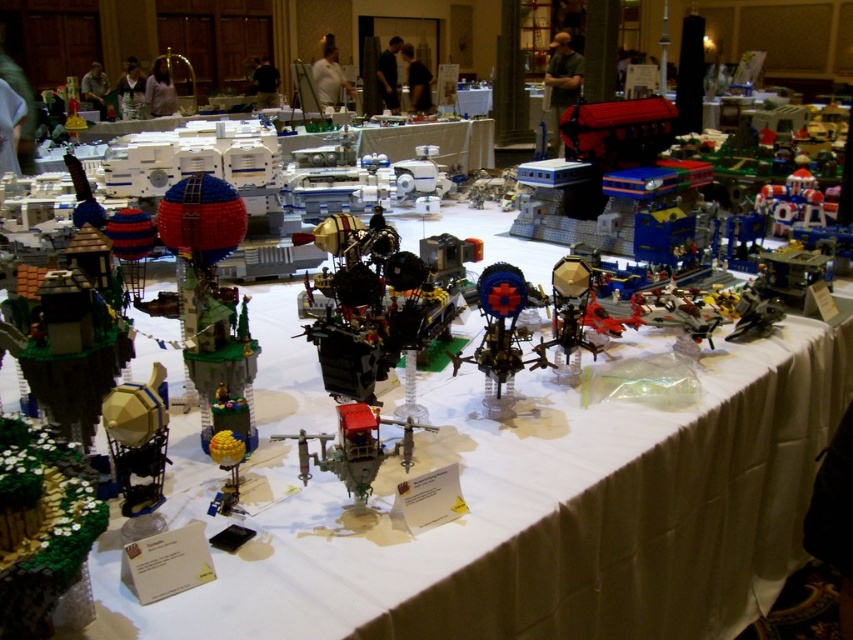
Question: Which object appears closest to the camera in this image?

Choices:
 (A) metallic blue sphere at center
 (B) metallic gold sphere at center
 (C) matte red helicopter at center

Answer: (A)

Question: Where is green grassy tree at lower left located in relation to metallic blue sphere at center in the image?

Choices:
 (A) above
 (B) below

Answer: (B)

Question: Is brick-like hot air balloon at center-left to the left of metallic gold sphere at center from the viewer's perspective?

Choices:
 (A) no
 (B) yes

Answer: (B)

Question: Considering the real-world distances, which object is farthest from the translucent plastic spaceship at center?

Choices:
 (A) metallic blue sphere at center
 (B) matte red helicopter at center

Answer: (A)

Question: Estimate the real-world distances between objects in this image. Which object is closer to the translucent plastic spaceship at center?

Choices:
 (A) matte red helicopter at center
 (B) metallic blue sphere at center
 (C) metallic gold sphere at center

Answer: (C)

Question: Where is metallic blue sphere at center located in relation to matte red helicopter at center in the image?

Choices:
 (A) below
 (B) above

Answer: (B)